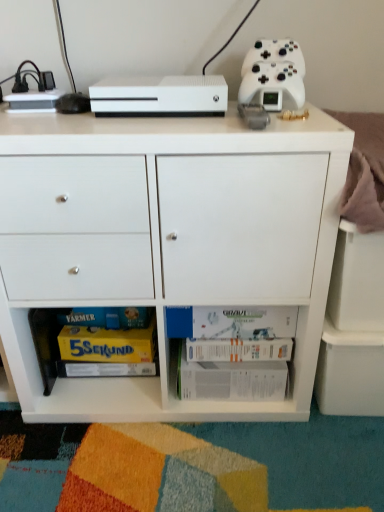
Question: Does white matte board game at lower center, placed as the 2th book when sorted from bottom to top, appear on the left side of white paper book at lower center, the 2th book in the top-to-bottom sequence?

Choices:
 (A) yes
 (B) no

Answer: (B)

Question: Are white matte board game at lower center, the 1th book from the top, and white paper book at lower center, the 2th book in the top-to-bottom sequence, located far from each other?

Choices:
 (A) yes
 (B) no

Answer: (B)

Question: Can you confirm if white matte board game at lower center, placed as the 2th book when sorted from bottom to top, is taller than white paper book at lower center, the 2th book in the top-to-bottom sequence?

Choices:
 (A) yes
 (B) no

Answer: (B)

Question: From a real-world perspective, does white matte board game at lower center, placed as the 2th book when sorted from bottom to top, sit lower than white paper book at lower center, the 2th book in the top-to-bottom sequence?

Choices:
 (A) yes
 (B) no

Answer: (B)

Question: Considering the relative positions of white matte board game at lower center, the 1th book from the top, and white paper book at lower center, the 2th book in the top-to-bottom sequence, in the image provided, is white matte board game at lower center, the 1th book from the top, behind white paper book at lower center, the 2th book in the top-to-bottom sequence,?

Choices:
 (A) no
 (B) yes

Answer: (A)

Question: Is white paper book at lower center, which appears as the first book when ordered from the bottom, situated inside white matte controller at upper right or outside?

Choices:
 (A) outside
 (B) inside

Answer: (A)

Question: Is white paper book at lower center, which appears as the first book when ordered from the bottom, wider or thinner than white matte controller at upper right?

Choices:
 (A) thin
 (B) wide

Answer: (B)

Question: In terms of height, does white paper book at lower center, the 2th book in the top-to-bottom sequence, look taller or shorter compared to white matte controller at upper right?

Choices:
 (A) tall
 (B) short

Answer: (B)

Question: Is point (195, 344) positioned closer to the camera than point (284, 89)?

Choices:
 (A) closer
 (B) farther

Answer: (B)

Question: Considering the positions of white matte board game at lower center, the 1th book from the top, and white matte cabinet at center in the image, is white matte board game at lower center, the 1th book from the top, taller or shorter than white matte cabinet at center?

Choices:
 (A) tall
 (B) short

Answer: (B)

Question: Based on their sizes in the image, would you say white matte board game at lower center, placed as the 2th book when sorted from bottom to top, is bigger or smaller than white matte cabinet at center?

Choices:
 (A) big
 (B) small

Answer: (B)

Question: Relative to white matte cabinet at center, is white matte board game at lower center, the 1th book from the top, in front or behind?

Choices:
 (A) front
 (B) behind

Answer: (B)

Question: Is white matte board game at lower center, the 1th book from the top, situated inside white matte cabinet at center or outside?

Choices:
 (A) outside
 (B) inside

Answer: (B)

Question: From the image's perspective, relative to white matte xbox one s at upper center, is white matte controller at upper right above or below?

Choices:
 (A) below
 (B) above

Answer: (B)

Question: Is white matte controller at upper right situated inside white matte xbox one s at upper center or outside?

Choices:
 (A) outside
 (B) inside

Answer: (A)